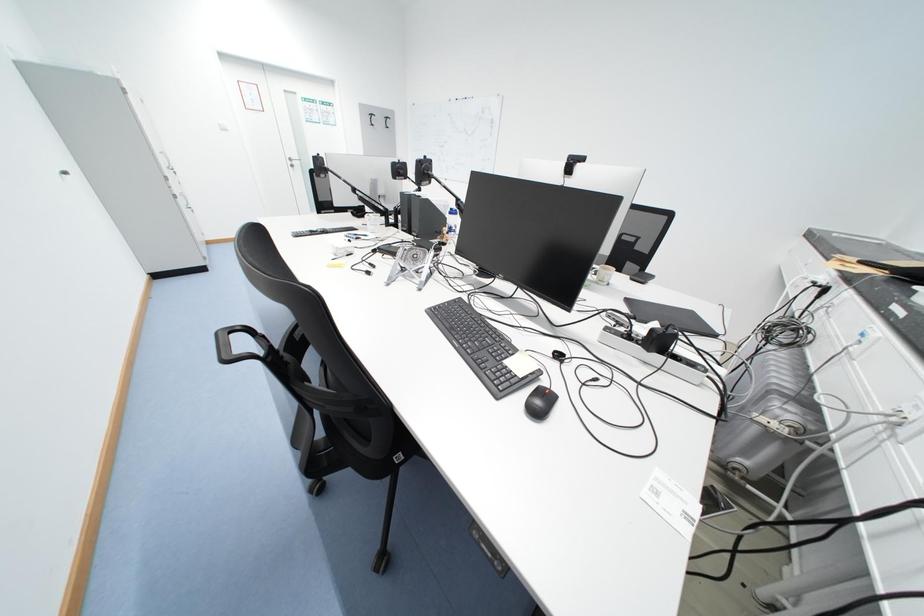
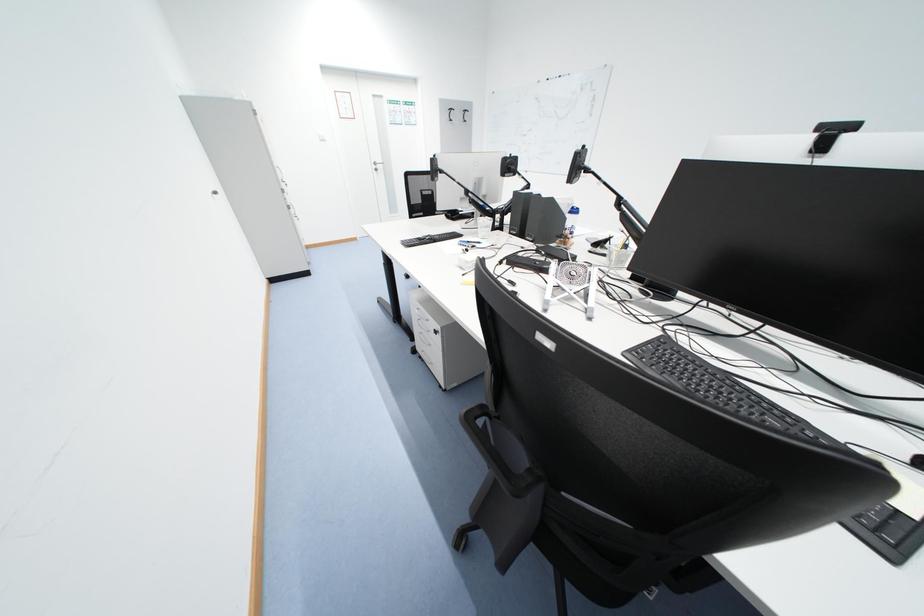
Question: The camera is either moving clockwise (left) or counter-clockwise (right) around the object. The first image is from the beginning of the video and the second image is from the end. Is the camera moving left or right when shooting the video?

Choices:
 (A) Left
 (B) Right

Answer: (B)